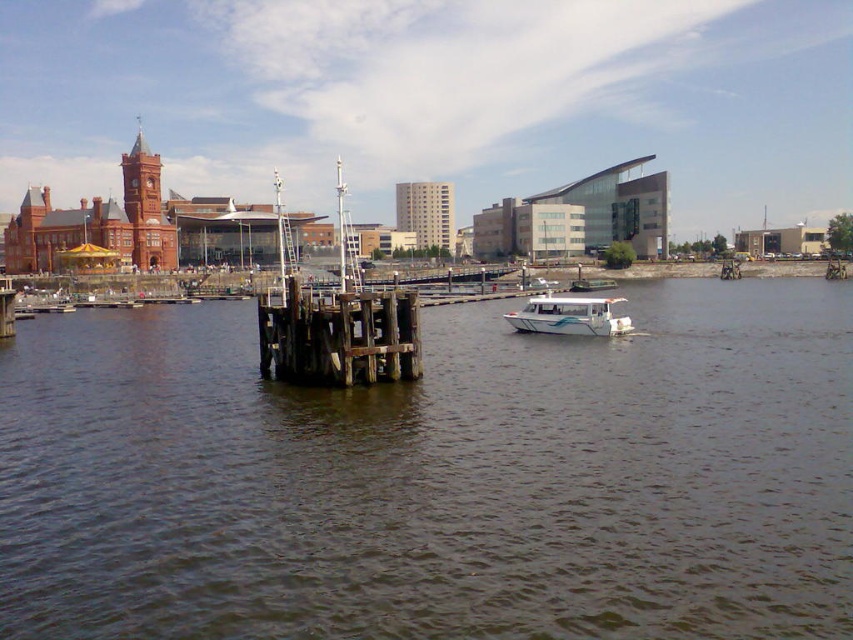
You are a tour guide planning to walk from the brown wooden dock at center to the white glossy boat at center. The distance between them is 66.38 feet. If your average walking speed is 3 feet per second, how many seconds will it take you to reach the boat?

The distance between the brown wooden dock at center and the white glossy boat at center is 66.38 feet. At a walking speed of 3 feet per second, it will take approximately 22.13 seconds to reach the boat.

You are standing on the brown wooden dock at center and want to reach the wooden at center. Which direction should you move to get closer to it?

The wooden at center is further away from you than the brown wooden dock at center, so you should move forward towards it to get closer.

You are a boat captain navigating a vessel that requires a minimum of 5 meters of clearance between the brown wooden dock at center and wooden at center to safely pass through. Can your boat navigate through this space?

The distance between the brown wooden dock at center and wooden at center is 8.35 meters, which exceeds the required 5 meters of clearance. Therefore, your boat can safely navigate through this space.